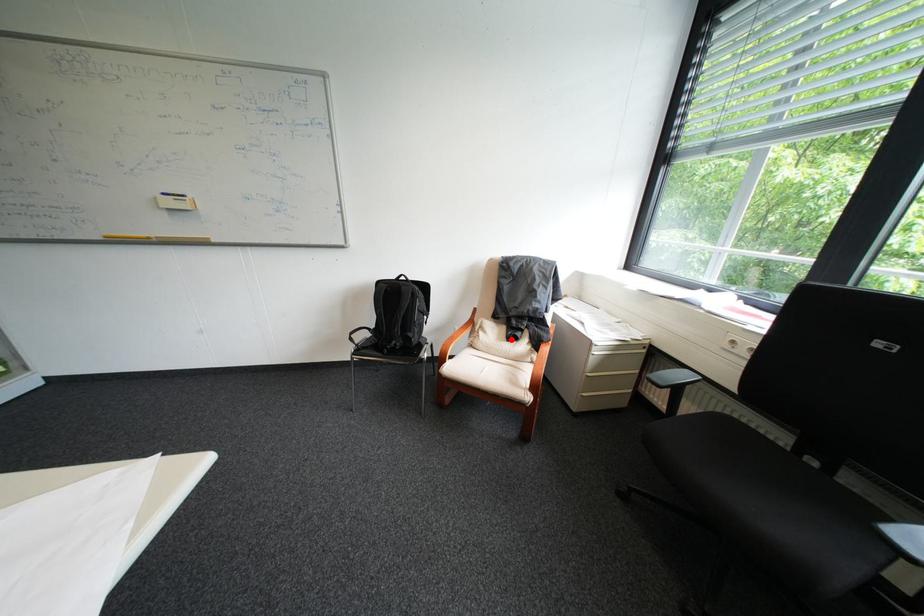
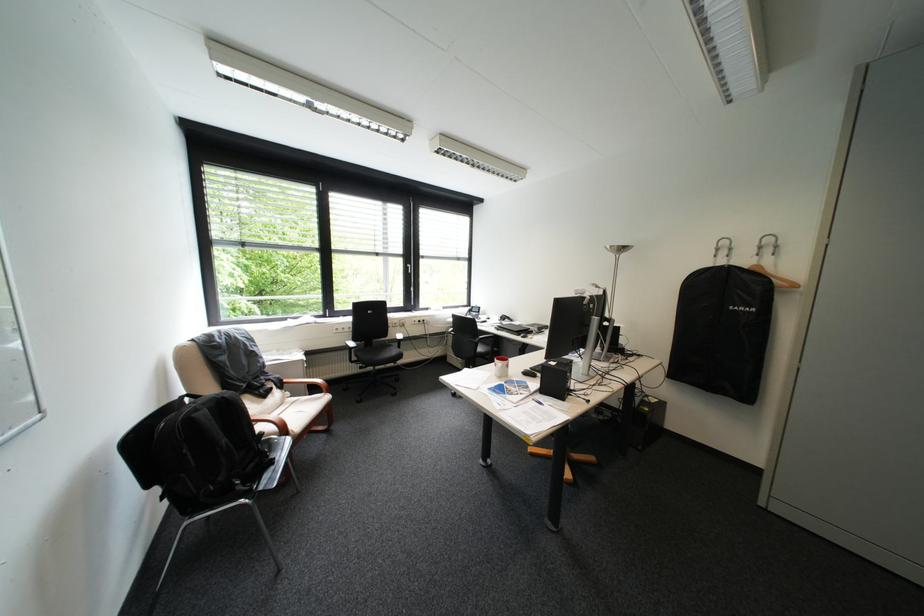
Question: I am providing you with two images of the same scene from different viewpoints. Image1 has a red point marked. In image2, the corresponding 3D location appears at what relative position? Reply with the corresponding letter.

Choices:
 (A) Closer
 (B) Farther

Answer: (A)